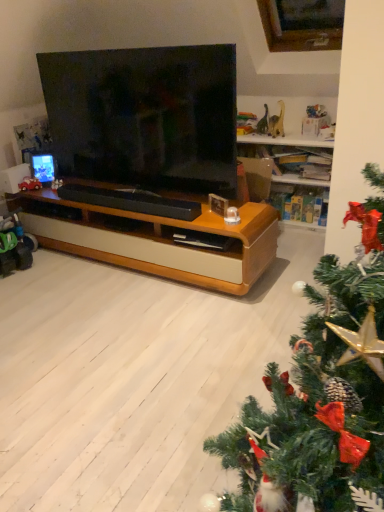
At what (x,y) coordinates should I click in order to perform the action: click on free location to the right of green plastic toy at left, the 1th toy viewed from the front. Please return your answer as a coordinate pair (x, y). Image resolution: width=384 pixels, height=512 pixels. Looking at the image, I should click on (41, 265).